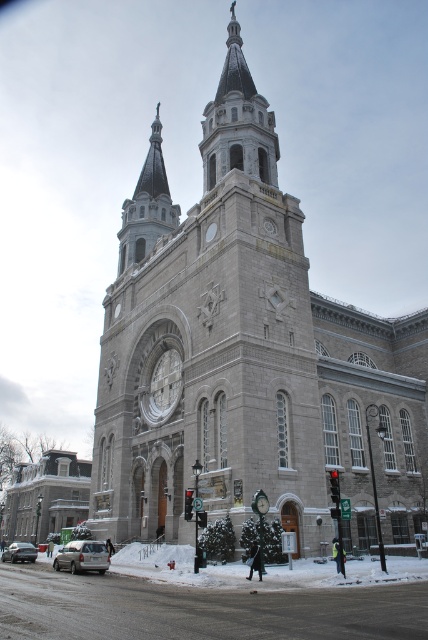
Does gray stone church at lower left have a smaller size compared to silver metallic suv at lower left?

No, gray stone church at lower left is not smaller than silver metallic suv at lower left.

Which is behind, point (83, 504) or point (74, 561)?

Positioned behind is point (83, 504).

Identify the location of gray stone church at lower left. (45, 497).

Can you confirm if gray stone church at lower left is bigger than silver metallic sedan at lower left?

Correct, gray stone church at lower left is larger in size than silver metallic sedan at lower left.

Does point (30, 528) come in front of point (17, 561)?

No, it is not.

At what (x,y) coordinates should I click in order to perform the action: click on gray stone church at lower left. Please return your answer as a coordinate pair (x, y). Looking at the image, I should click on (45, 497).

At what (x,y) coordinates should I click in order to perform the action: click on gray stone church at center. Please return your answer as a coordinate pair (x, y). The height and width of the screenshot is (640, 428). Looking at the image, I should click on pos(246,355).